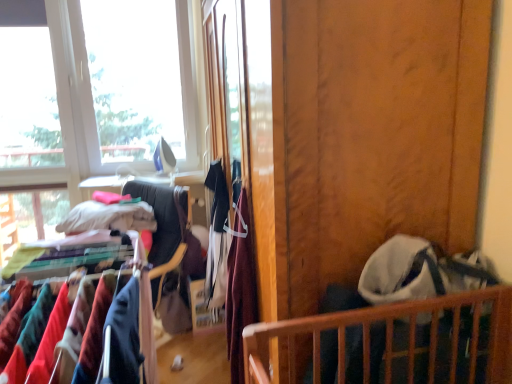
Question: From a real-world perspective, is wooden screen door at center over wooden crib at lower right?

Choices:
 (A) yes
 (B) no

Answer: (A)

Question: Is wooden screen door at center closer to camera compared to wooden crib at lower right?

Choices:
 (A) yes
 (B) no

Answer: (A)

Question: Are wooden screen door at center and wooden crib at lower right beside each other?

Choices:
 (A) yes
 (B) no

Answer: (B)

Question: From the image's perspective, is wooden screen door at center on wooden crib at lower right?

Choices:
 (A) yes
 (B) no

Answer: (A)

Question: Can wooden crib at lower right be found inside wooden screen door at center?

Choices:
 (A) yes
 (B) no

Answer: (B)

Question: Considering the positions of velvet burgundy dress at center, which is the 1th clothing from front to back, and white cotton shirt at center, which is counted as the 1th clothing, starting from the left, in the image, is velvet burgundy dress at center, which is the 1th clothing from front to back, wider or thinner than white cotton shirt at center, which is counted as the 1th clothing, starting from the left,?

Choices:
 (A) wide
 (B) thin

Answer: (B)

Question: Is velvet burgundy dress at center, marked as the 1th clothing in a right-to-left arrangement, situated inside white cotton shirt at center, which is counted as the 1th clothing, starting from the left, or outside?

Choices:
 (A) inside
 (B) outside

Answer: (B)

Question: From a real-world perspective, relative to white cotton shirt at center, arranged as the 2th clothing when viewed from the front, is velvet burgundy dress at center, placed as the 2th clothing when sorted from back to front, vertically above or below?

Choices:
 (A) above
 (B) below

Answer: (A)

Question: In the image, is velvet burgundy dress at center, which is the 1th clothing from front to back, positioned in front of or behind white cotton shirt at center, arranged as the 2th clothing when viewed from the front?

Choices:
 (A) front
 (B) behind

Answer: (A)

Question: Choose the correct answer: Is velvet burgundy dress at center, marked as the 1th clothing in a right-to-left arrangement, inside velvet fabric clothes at center or outside it?

Choices:
 (A) inside
 (B) outside

Answer: (B)

Question: In the image, is velvet burgundy dress at center, which is the second clothing from left to right, positioned in front of or behind velvet fabric clothes at center?

Choices:
 (A) front
 (B) behind

Answer: (A)

Question: From a real-world perspective, relative to velvet fabric clothes at center, is velvet burgundy dress at center, placed as the 2th clothing when sorted from back to front, vertically above or below?

Choices:
 (A) below
 (B) above

Answer: (B)

Question: Considering the positions of velvet burgundy dress at center, which is the 1th clothing from front to back, and velvet fabric clothes at center in the image, is velvet burgundy dress at center, which is the 1th clothing from front to back, taller or shorter than velvet fabric clothes at center?

Choices:
 (A) tall
 (B) short

Answer: (B)

Question: Relative to white cotton shirt at center, which is counted as the 1th clothing, starting from the left, is velvet fabric clothes at center in front or behind?

Choices:
 (A) front
 (B) behind

Answer: (A)

Question: Looking at their shapes, would you say velvet fabric clothes at center is wider or thinner than white cotton shirt at center, arranged as the 2th clothing when viewed from the front?

Choices:
 (A) thin
 (B) wide

Answer: (B)